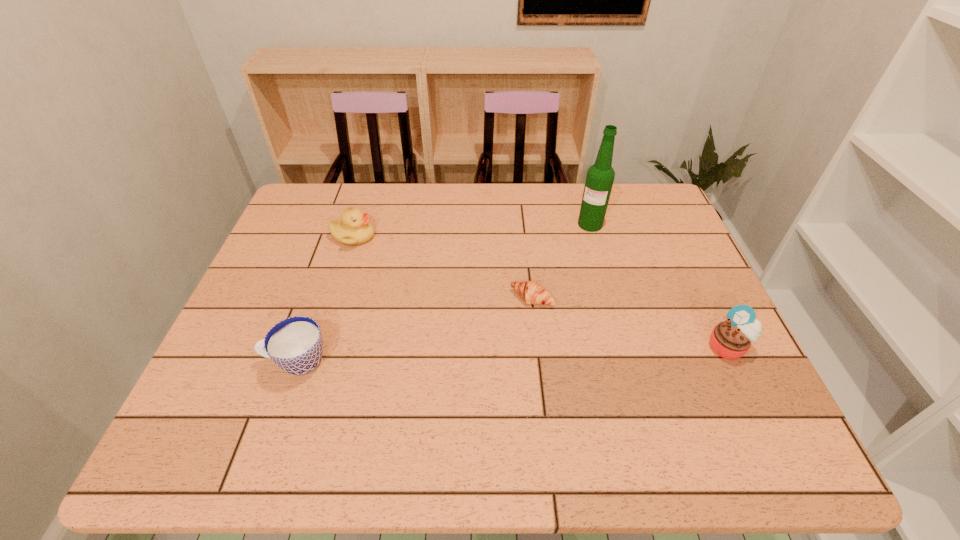
Where is `free space between the duckling and the cup`? free space between the duckling and the cup is located at coordinates (324, 299).

Where is `free space between the cup and the tallest object`? free space between the cup and the tallest object is located at coordinates (444, 293).

This screenshot has width=960, height=540. I want to click on free space between the cup and the shortest object, so click(x=414, y=330).

Locate an element on the screen. This screenshot has width=960, height=540. empty space between the fourth shortest object and the shortest object is located at coordinates (630, 323).

Identify the location of object that is the second closest to the pastry. (731, 339).

Find the location of a particular element. object that is the second closest to the duckling is located at coordinates (531, 292).